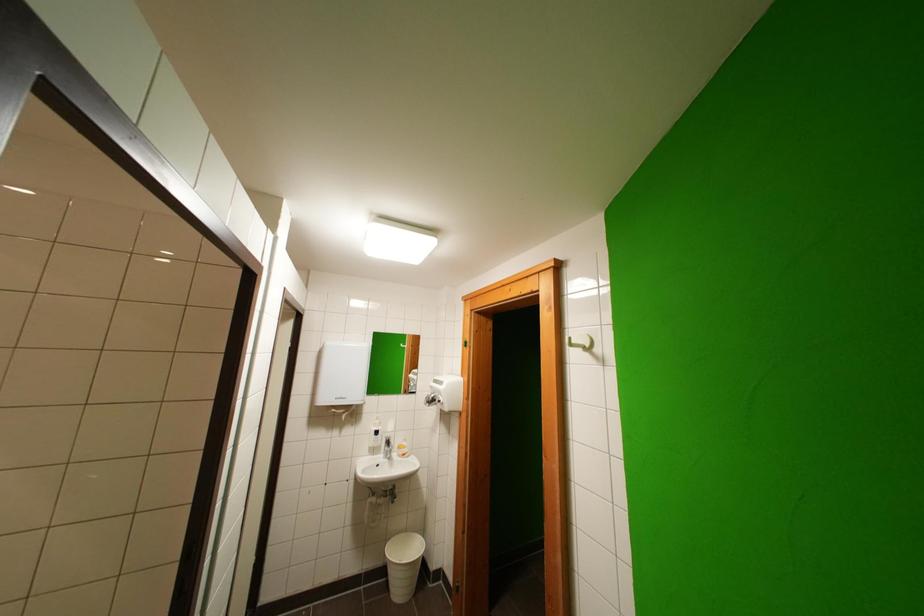
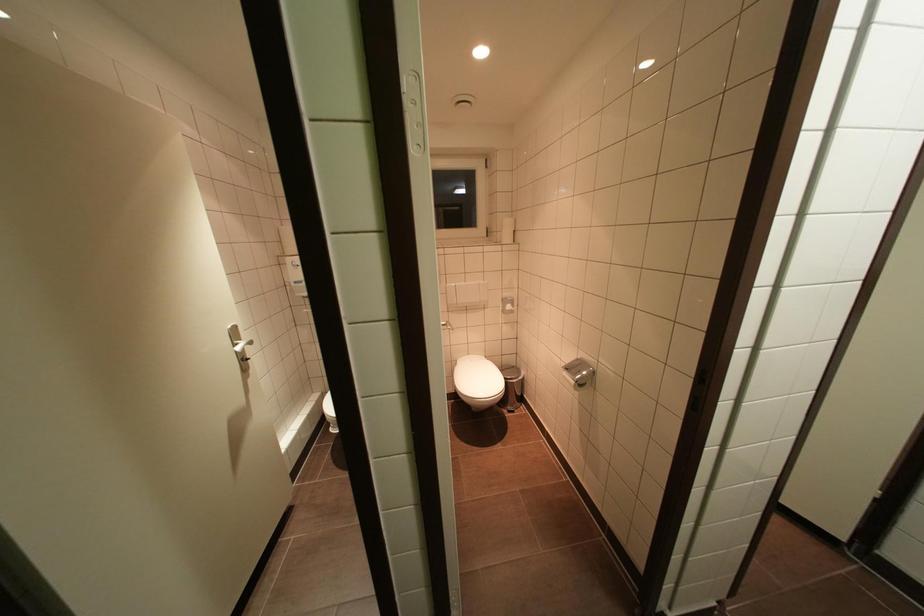
Question: The first image is from the beginning of the video and the second image is from the end. How did the camera likely rotate when shooting the video?

Choices:
 (A) Left
 (B) Right
 (C) Up
 (D) Down

Answer: (A)